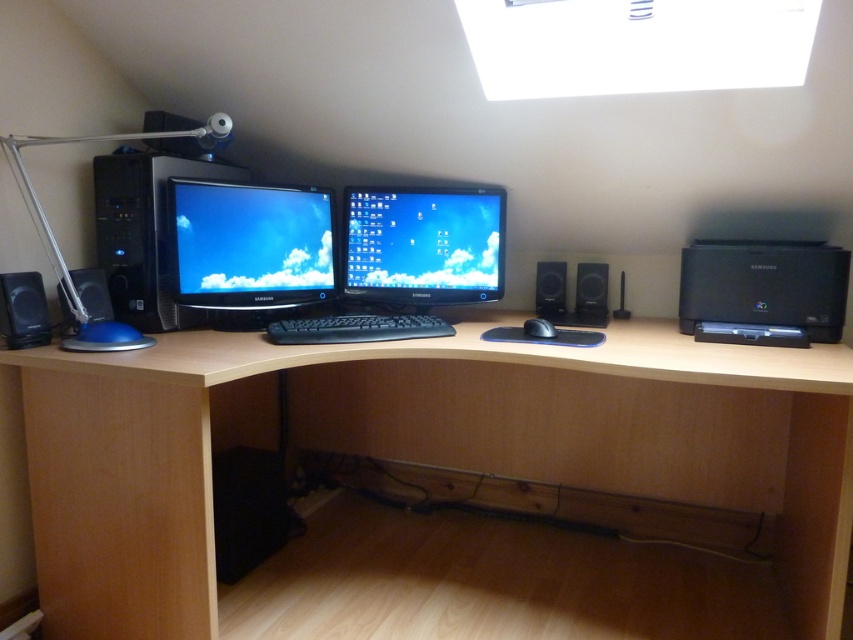
Question: Which of the following is the closest to the observer?

Choices:
 (A) black plastic printer at right
 (B) satin black monitor at center
 (C) black matte speaker at center

Answer: (A)

Question: Can you confirm if black matte keyboard at center is thinner than black plastic speaker at left?

Choices:
 (A) no
 (B) yes

Answer: (A)

Question: Among these objects, which one is farthest from the camera?

Choices:
 (A) black matte keyboard at center
 (B) metallic silver desk lamp at upper left
 (C) black plastic speaker at left
 (D) black plastic speaker at right

Answer: (D)

Question: Among these points, which one is farthest from the camera?

Choices:
 (A) (397, 205)
 (B) (599, 387)
 (C) (540, 280)

Answer: (C)

Question: Is matte black speaker at left below black plastic speaker at right?

Choices:
 (A) yes
 (B) no

Answer: (B)

Question: Can you confirm if matte black speaker at left is thinner than black plastic speaker at right?

Choices:
 (A) no
 (B) yes

Answer: (A)